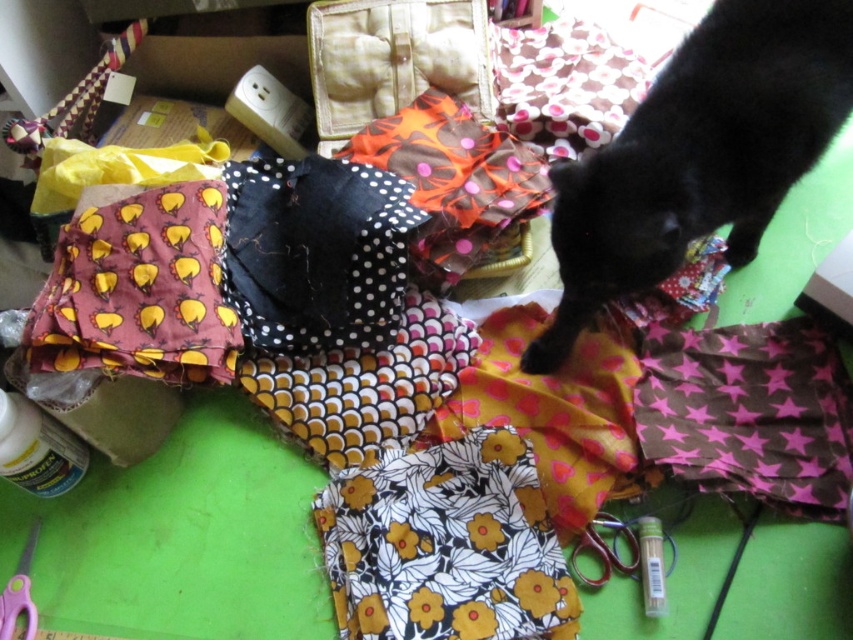
You are organizing the workspace and need to place the yellow polka dot fabric at center and the pink plastic scissors at lower left into a drawer. The drawer has a width limit. Which object might not fit if the drawer is sized for the narrower item?

The yellow polka dot fabric at center might not fit into the drawer if it is sized for the narrower item, as its width surpasses that of the pink plastic scissors at lower left.

You are organizing the workspace and need to place a new item at the coordinates mentioned for the yellow polka dot fabric at center. Is there already an object at that location?

Yes, the yellow polka dot fabric at center is already located at point (140, 291), so placing another item there would require moving it.